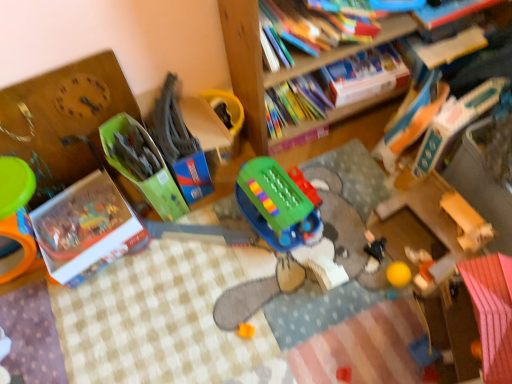
Where is `blank space to the left of rubberized orange ball at lower right, acting as the sixth toy starting from the left`? This screenshot has height=384, width=512. blank space to the left of rubberized orange ball at lower right, acting as the sixth toy starting from the left is located at coordinates (368, 284).